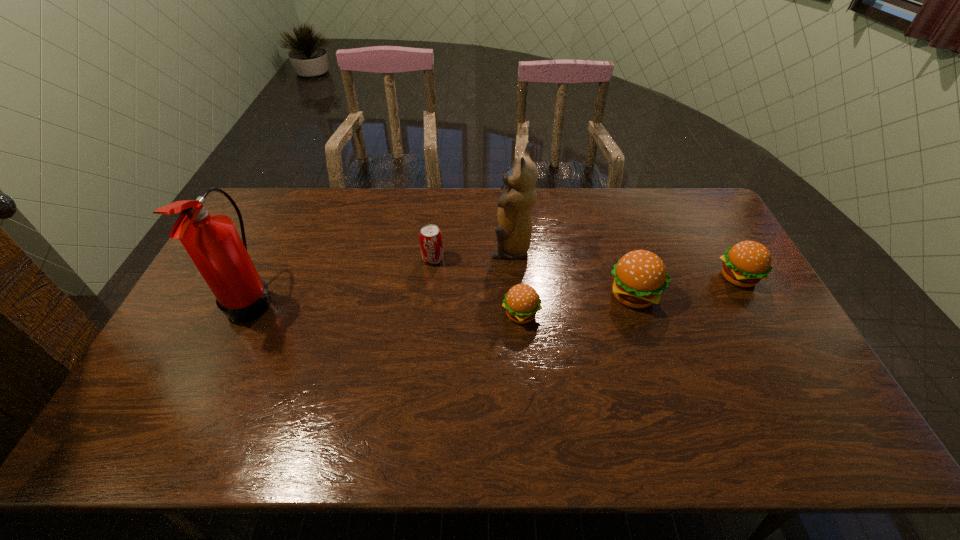
Where is `the shortest object`? This screenshot has height=540, width=960. the shortest object is located at coordinates (522, 302).

Where is `the shortest hamburger`? This screenshot has width=960, height=540. the shortest hamburger is located at coordinates (522, 302).

Locate an element on the screen. This screenshot has height=540, width=960. the fourth shortest object is located at coordinates (639, 277).

Find the location of a particular element. The image size is (960, 540). the fifth object from left to right is located at coordinates (639, 277).

Find the location of a particular element. Image resolution: width=960 pixels, height=540 pixels. the rightmost hamburger is located at coordinates (746, 263).

I want to click on the second shortest hamburger, so click(746, 263).

Image resolution: width=960 pixels, height=540 pixels. I want to click on fire extinguisher, so click(211, 240).

I want to click on the second object from left to right, so click(x=431, y=244).

Identify the location of cat. The image size is (960, 540). (514, 231).

Where is `vacant space located on the front of the shortest hamburger`? vacant space located on the front of the shortest hamburger is located at coordinates (528, 395).